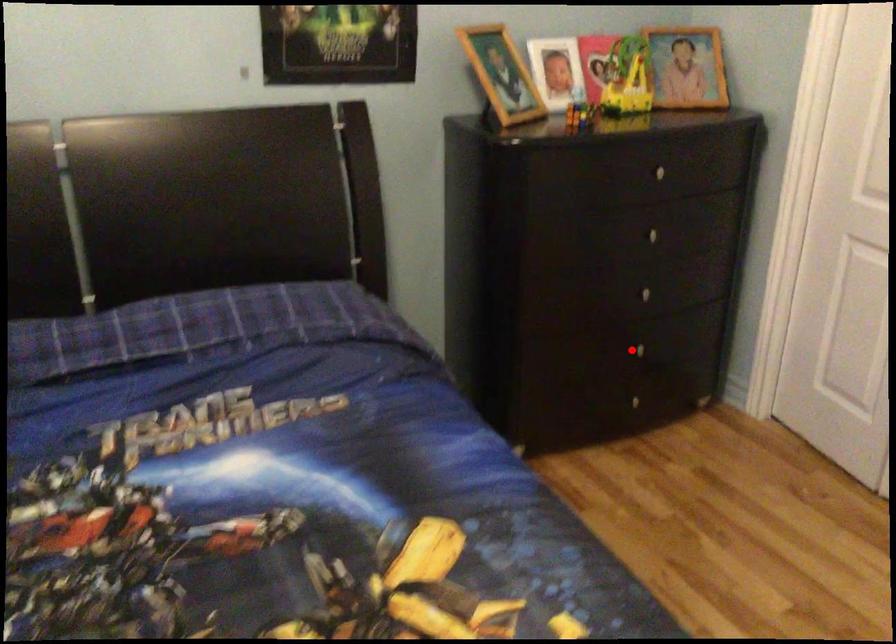
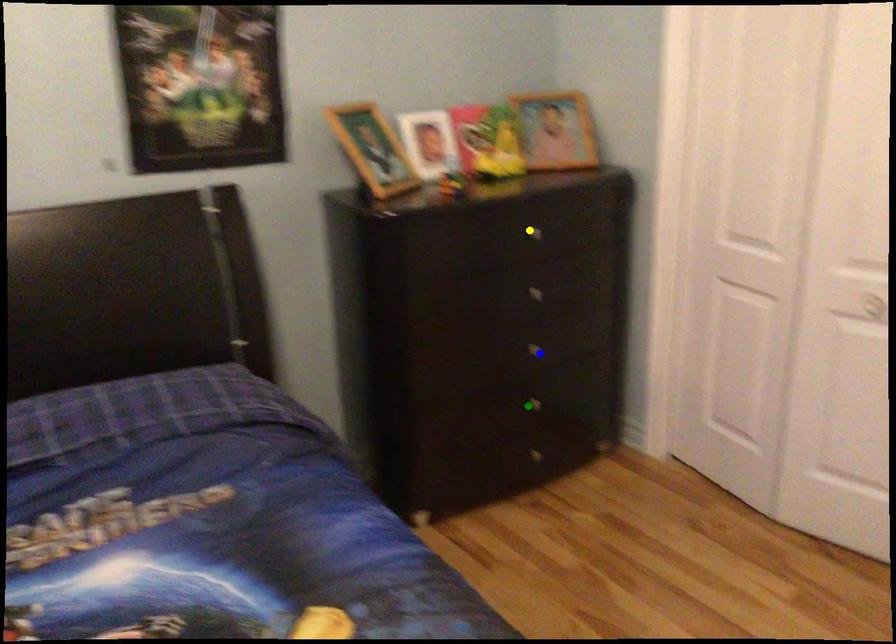
Question: I am providing you with two images of the same scene from different viewpoints. A red point is marked on the first image. You are given multiple points on the second image. Can you choose the point in image 2 that corresponds to the point in image 1?

Choices:
 (A) green point
 (B) yellow point
 (C) blue point

Answer: (A)